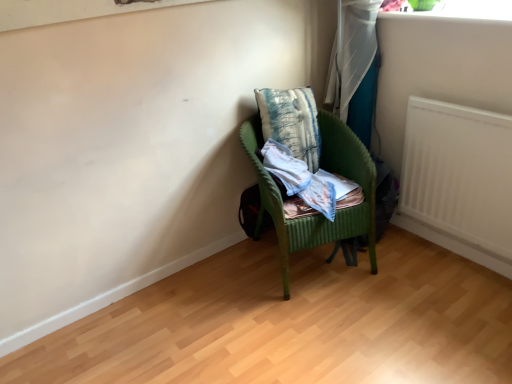
Where is `blank space situated above light blue cotton shirt at center (from a real-world perspective)`? Image resolution: width=512 pixels, height=384 pixels. blank space situated above light blue cotton shirt at center (from a real-world perspective) is located at coordinates (328, 187).